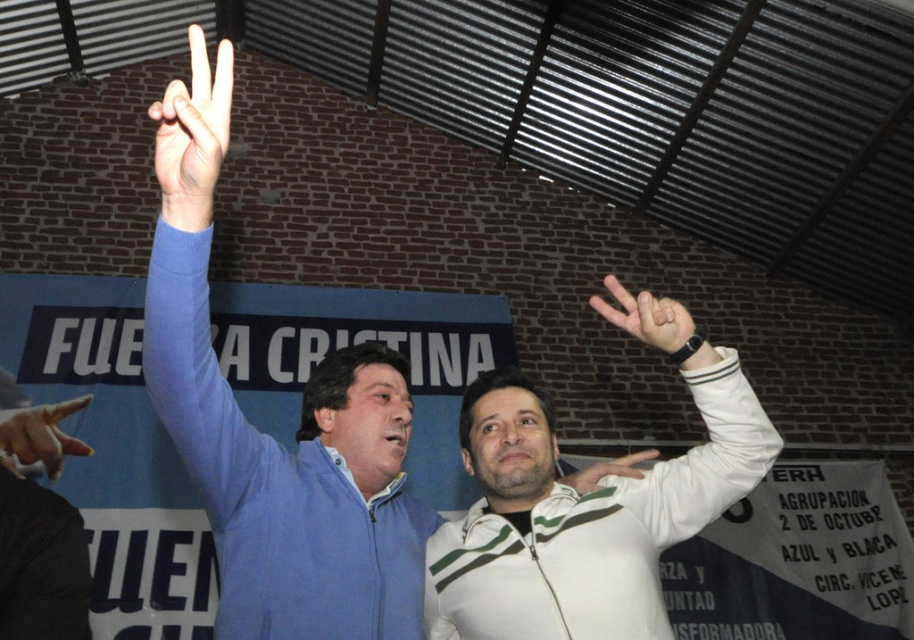
You are a photographer adjusting the lighting for a photo shoot. You notice the blue fabric sleeve at upper left and the matte white hand at upper center in the frame. Which object should you focus on to ensure proper exposure if the thinner object requires more light?

The blue fabric sleeve at upper left is thinner than the matte white hand at upper center, so you should focus on the blue fabric sleeve at upper left to ensure proper exposure since it requires more light.

You are standing in front of the brick wall and want to place a sticker on the point that is closer to you. Which point should you choose between point (721, 388) and point (197, 209)?

Point (721, 388) is further to the viewer than point (197, 209), so you should choose point (197, 209) as it is closer to you.

You are a photographer taking a picture of the blue fabric sleeve at upper left and the matte white hand at upper center. Which object is positioned in front of the other in the image?

The blue fabric sleeve at upper left is closer to the viewer than the matte white hand at upper center, so it is positioned in front of the matte white hand at upper center.